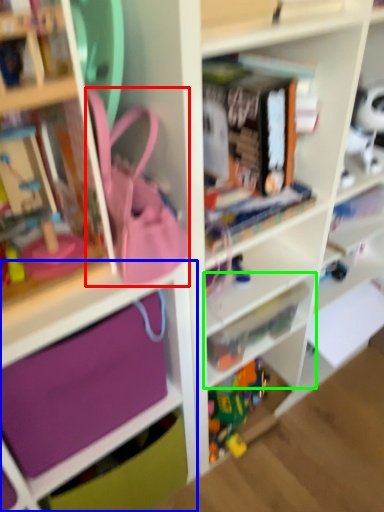
Question: Based on their relative distances, which object is farther from accessory (highlighted by a red box)? Choose from cabinet (highlighted by a blue box) and shelf (highlighted by a green box).

Choices:
 (A) cabinet
 (B) shelf

Answer: (B)